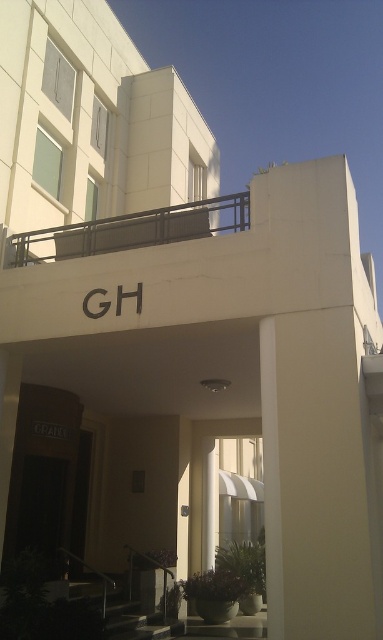
Based on the photo, you are standing at the entrance of the building and want to reach the door. Which object should you avoid stepping over first, the metallic gray balustrade at upper center or the metallic rail at lower center?

The metallic rail at lower center should be avoided first since it is closer to the entrance and located below the metallic gray balustrade at upper center.

You are a maintenance worker tasked with checking the safety of the balustrades and rails at the building entrance. You have a measuring tape and need to determine which one is wider between the metallic gray balustrade at upper center and the metallic rail at lower center without direct measurement. Based on the scene description, which one should you prioritize checking first due to its width?

The metallic gray balustrade at upper center is wider than the metallic rail at lower center, so you should prioritize checking the metallic gray balustrade at upper center first due to its larger width.

You are a maintenance worker tasked with inspecting the metallic gray balustrade at upper center and the metallic rail at lower center. Which one requires a ladder to reach?

The metallic gray balustrade at upper center is shorter than the metallic rail at lower center, so the metallic rail at lower center is taller and would require a ladder to reach.